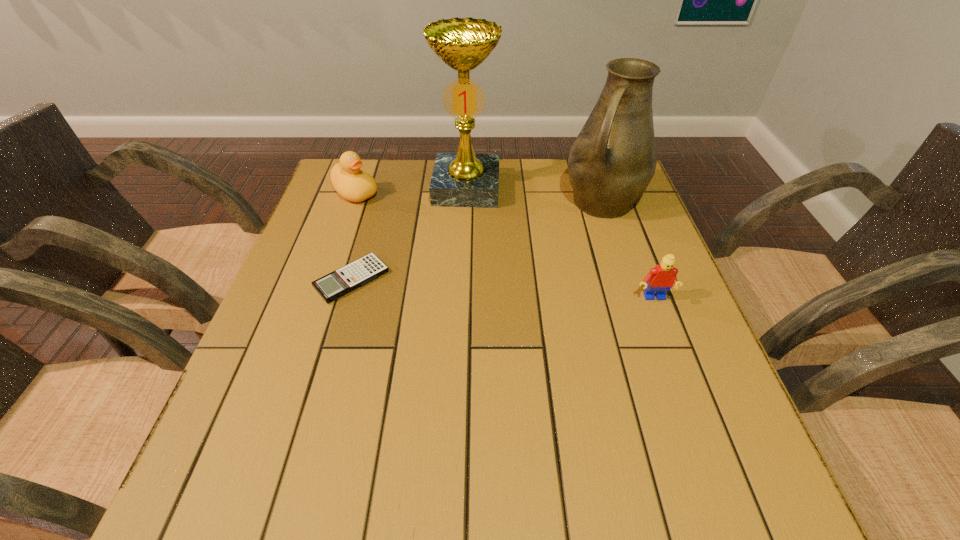
Image resolution: width=960 pixels, height=540 pixels. I want to click on free space that is in between the award and the calculator, so click(409, 234).

The image size is (960, 540). Identify the location of free space that is in between the shortest object and the pitcher. (477, 241).

The height and width of the screenshot is (540, 960). What are the coordinates of `unoccupied area between the calculator and the pitcher` in the screenshot? It's located at (477, 241).

Where is `free spot between the award and the duck`? free spot between the award and the duck is located at coordinates (411, 191).

Locate an element on the screen. Image resolution: width=960 pixels, height=540 pixels. free space between the award and the calculator is located at coordinates (409, 234).

Locate an element on the screen. The image size is (960, 540). free spot between the third object from right to left and the pitcher is located at coordinates (535, 195).

I want to click on free space between the fourth shortest object and the Lego, so click(x=628, y=251).

Locate an element on the screen. This screenshot has width=960, height=540. free point between the pitcher and the third object from right to left is located at coordinates (535, 195).

This screenshot has width=960, height=540. In order to click on free space between the fourth shortest object and the calculator in this screenshot , I will do `click(477, 241)`.

Image resolution: width=960 pixels, height=540 pixels. In order to click on the second closest object relative to the duck in this screenshot , I will do `click(338, 283)`.